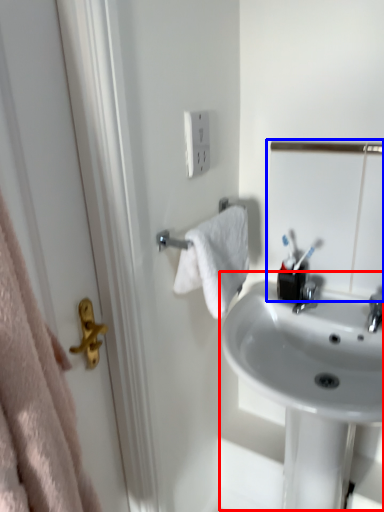
Question: Which object appears closest to the camera in this image, sink (highlighted by a red box) or mirror (highlighted by a blue box)?

Choices:
 (A) sink
 (B) mirror

Answer: (A)